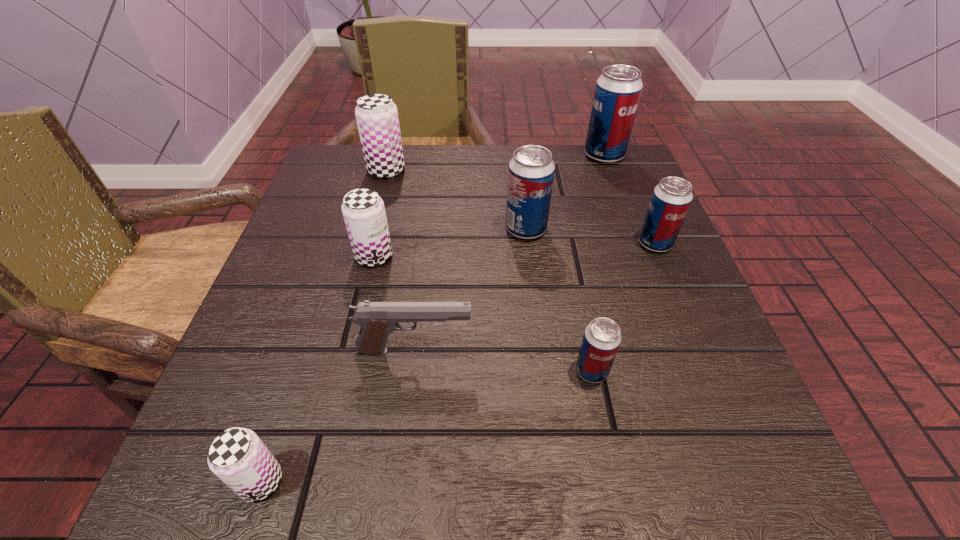
What are the coordinates of `the nearest beer can` in the screenshot? It's located at (237, 456).

What are the coordinates of `the nearest object` in the screenshot? It's located at (237, 456).

Where is `free region located on the front of the tallest beer can`? Image resolution: width=960 pixels, height=540 pixels. free region located on the front of the tallest beer can is located at coordinates (629, 223).

Locate an element on the screen. vacant area situated 0.200m on the front of the farthest purple beer can is located at coordinates (368, 240).

Where is `vacant space located on the front of the fifth object from left to right`? This screenshot has width=960, height=540. vacant space located on the front of the fifth object from left to right is located at coordinates (532, 280).

The image size is (960, 540). I want to click on free space located on the front of the second farthest purple beer can, so click(358, 322).

The image size is (960, 540). Identify the location of blank area located 0.150m on the back of the second smallest red beer can. (632, 188).

The height and width of the screenshot is (540, 960). In order to click on free space located 0.160m at the barrel of the third nearest object in this screenshot , I will do `click(577, 350)`.

Where is `vacant space located on the right of the seventh farthest object`? vacant space located on the right of the seventh farthest object is located at coordinates (676, 370).

At what (x,y) coordinates should I click in order to perform the action: click on vacant space situated on the left of the nearest purple beer can. Please return your answer as a coordinate pair (x, y). Image resolution: width=960 pixels, height=540 pixels. Looking at the image, I should click on (199, 481).